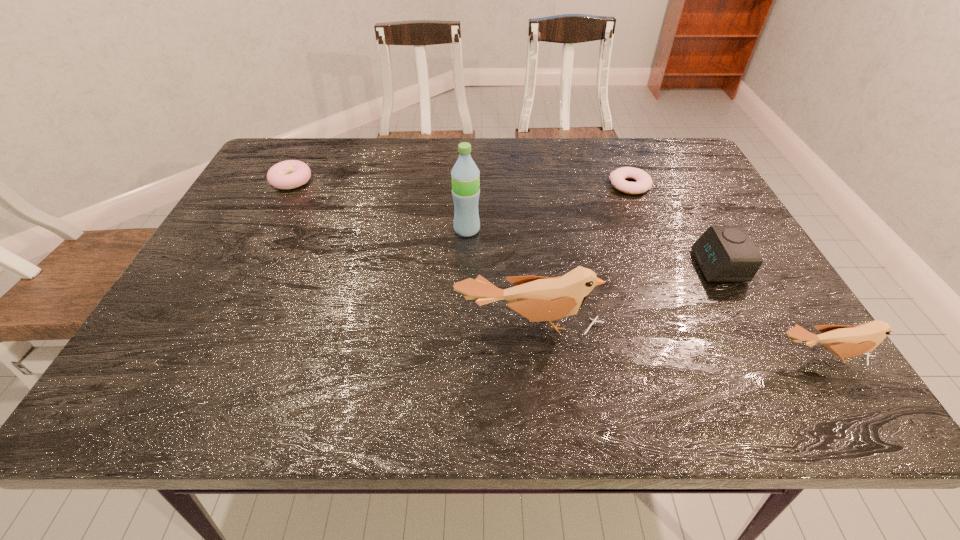
Locate an element on the screen. alarm clock situated at the right edge is located at coordinates (724, 253).

This screenshot has width=960, height=540. Find the location of `object located at the far left corner`. object located at the far left corner is located at coordinates (289, 174).

Image resolution: width=960 pixels, height=540 pixels. What are the coordinates of `object situated at the near right corner` in the screenshot? It's located at (844, 341).

Identify the location of free region at the far edge. (347, 147).

Find the location of `vacant area at the near edge of the desktop`. vacant area at the near edge of the desktop is located at coordinates (276, 335).

At what (x,y) coordinates should I click in order to perform the action: click on vacant space at the left edge of the desktop. Please return your answer as a coordinate pair (x, y). The width and height of the screenshot is (960, 540). Looking at the image, I should click on (194, 301).

Where is `vacant space at the right edge of the desktop`? This screenshot has height=540, width=960. vacant space at the right edge of the desktop is located at coordinates (712, 214).

You are a GUI agent. You are given a task and a screenshot of the screen. Output one action in this format:
    pyautogui.click(x=<x>, y=<y>)
    Task: Click on the vacant space at the far left corner
    The width and height of the screenshot is (960, 540).
    Given the screenshot: What is the action you would take?
    pyautogui.click(x=301, y=156)

Image resolution: width=960 pixels, height=540 pixels. In the image, there is a desktop. Find the location of `free space at the near left corner`. free space at the near left corner is located at coordinates (191, 355).

Identify the location of vacant space at the far right corner of the desktop. (677, 147).